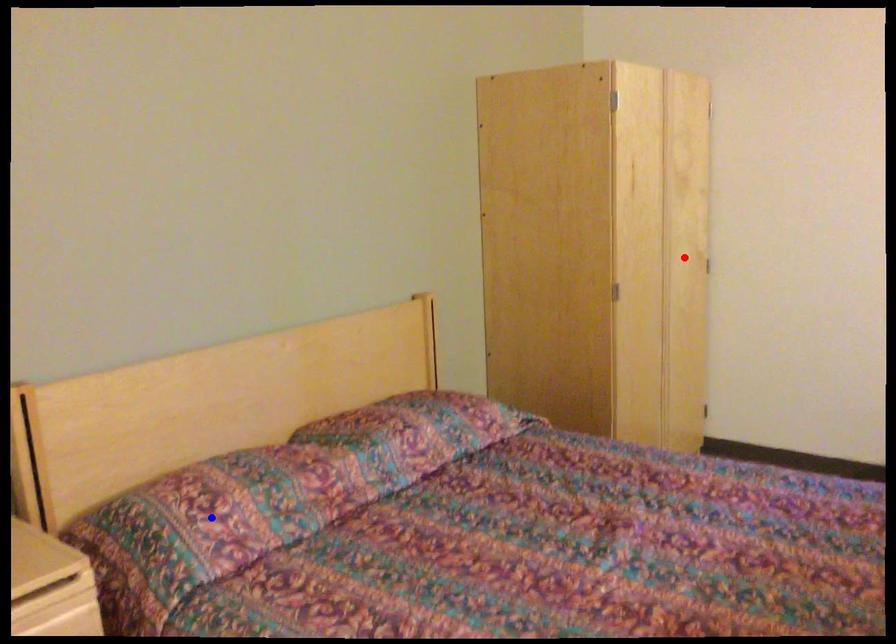
Question: In the image, two points are highlighted. Which point is nearer to the camera? Reply with the corresponding letter.

Choices:
 (A) blue point
 (B) red point

Answer: (A)